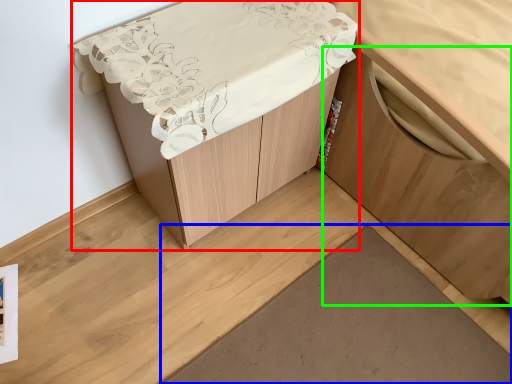
Question: Which is farther away from furniture (highlighted by a red box)? plank (highlighted by a blue box) or cabinetry (highlighted by a green box)?

Choices:
 (A) plank
 (B) cabinetry

Answer: (A)